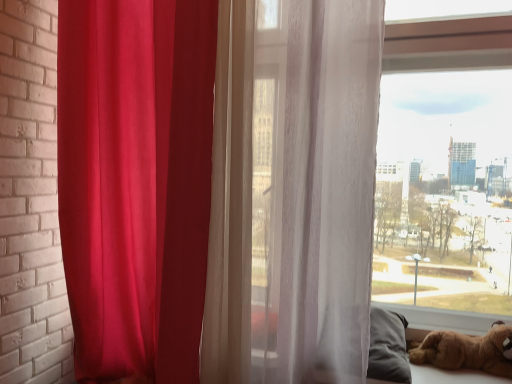
Measure the distance between point [473,350] and camera.

The distance of point [473,350] from camera is 1.62 meters.

Image resolution: width=512 pixels, height=384 pixels. Find the location of `brown plush toy at lower right`. brown plush toy at lower right is located at coordinates (466, 351).

Which object is wider, brown plush toy at lower right or translucent white curtain at center, which is counted as the second curtain, starting from the left?

With larger width is translucent white curtain at center, which is counted as the second curtain, starting from the left.

In the scene shown: Is brown plush toy at lower right not near translucent white curtain at center, which is counted as the second curtain, starting from the left?

Actually, brown plush toy at lower right and translucent white curtain at center, which is counted as the second curtain, starting from the left, are a little close together.

From the picture: Can you confirm if brown plush toy at lower right is positioned to the right of translucent white curtain at center, the 1th curtain from the right?

Yes.

Where is `dog lying behind the translucent white curtain at center, the 1th curtain from the right`? Image resolution: width=512 pixels, height=384 pixels. dog lying behind the translucent white curtain at center, the 1th curtain from the right is located at coordinates (466, 351).

Which object is positioned more to the right, translucent white curtain at center, which is counted as the second curtain, starting from the left, or brown plush toy at lower right?

From the viewer's perspective, brown plush toy at lower right appears more on the right side.

How many degrees apart are the facing directions of translucent white curtain at center, the 1th curtain from the right, and brown plush toy at lower right?

The angular difference between translucent white curtain at center, the 1th curtain from the right, and brown plush toy at lower right is 2.74 degrees.

Can you confirm if translucent white curtain at center, which is counted as the second curtain, starting from the left, is bigger than brown plush toy at lower right?

Yes, translucent white curtain at center, which is counted as the second curtain, starting from the left, is bigger than brown plush toy at lower right.

How far apart are translucent white curtain at center, which is counted as the second curtain, starting from the left, and brown plush toy at lower right?

They are 26.95 inches apart.

From the image's perspective, is translucent white curtain at center, which is counted as the second curtain, starting from the left, beneath matte red curtain at left, the first curtain viewed from the left?

Yes, from the image's perspective, translucent white curtain at center, which is counted as the second curtain, starting from the left, is below matte red curtain at left, the first curtain viewed from the left.

Which of these two, translucent white curtain at center, which is counted as the second curtain, starting from the left, or matte red curtain at left, which is the second curtain from right to left, stands shorter?

translucent white curtain at center, which is counted as the second curtain, starting from the left.

Is translucent white curtain at center, which is counted as the second curtain, starting from the left, directly adjacent to matte red curtain at left, which is the second curtain from right to left?

No, translucent white curtain at center, which is counted as the second curtain, starting from the left, is not in contact with matte red curtain at left, which is the second curtain from right to left.

Is translucent white curtain at center, the 1th curtain from the right, facing away from matte red curtain at left, which is the second curtain from right to left?

translucent white curtain at center, the 1th curtain from the right, does not have its back to matte red curtain at left, which is the second curtain from right to left.

Which object is wider, brown plush toy at lower right or matte red curtain at left, the first curtain viewed from the left?

matte red curtain at left, the first curtain viewed from the left.

Who is smaller, brown plush toy at lower right or matte red curtain at left, the first curtain viewed from the left?

Smaller between the two is brown plush toy at lower right.

Is brown plush toy at lower right positioned behind matte red curtain at left, the first curtain viewed from the left?

Yes, brown plush toy at lower right is behind matte red curtain at left, the first curtain viewed from the left.

Is brown plush toy at lower right far from matte red curtain at left, which is the second curtain from right to left?

Yes, brown plush toy at lower right and matte red curtain at left, which is the second curtain from right to left, are located far from each other.

Consider the image. Considering the sizes of matte red curtain at left, the first curtain viewed from the left, and translucent white curtain at center, which is counted as the second curtain, starting from the left, in the image, is matte red curtain at left, the first curtain viewed from the left, bigger or smaller than translucent white curtain at center, which is counted as the second curtain, starting from the left,?

Clearly, matte red curtain at left, the first curtain viewed from the left, is larger in size than translucent white curtain at center, which is counted as the second curtain, starting from the left.

From the image's perspective, is matte red curtain at left, the first curtain viewed from the left, below translucent white curtain at center, which is counted as the second curtain, starting from the left?

No, from the image's perspective, matte red curtain at left, the first curtain viewed from the left, is not below translucent white curtain at center, which is counted as the second curtain, starting from the left.

Is matte red curtain at left, the first curtain viewed from the left, positioned far away from translucent white curtain at center, the 1th curtain from the right?

matte red curtain at left, the first curtain viewed from the left, is near translucent white curtain at center, the 1th curtain from the right, not far away.

Is matte red curtain at left, which is the second curtain from right to left, facing towards translucent white curtain at center, the 1th curtain from the right?

No, matte red curtain at left, which is the second curtain from right to left, is not aimed at translucent white curtain at center, the 1th curtain from the right.

Is matte red curtain at left, the first curtain viewed from the left, far away from brown plush toy at lower right?

Absolutely, matte red curtain at left, the first curtain viewed from the left, is distant from brown plush toy at lower right.

Considering the sizes of matte red curtain at left, which is the second curtain from right to left, and brown plush toy at lower right in the image, is matte red curtain at left, which is the second curtain from right to left, taller or shorter than brown plush toy at lower right?

matte red curtain at left, which is the second curtain from right to left, is taller than brown plush toy at lower right.

Which is behind, point (137, 101) or point (506, 330)?

Point (137, 101)

Is matte red curtain at left, which is the second curtain from right to left, not inside brown plush toy at lower right?

Yes.

There is a brown plush toy at lower right. Identify the location of the 1st curtain above it (from a real-world perspective). click(314, 186).

Find the location of `the 1st curtain to the left of the brown plush toy at lower right, starting your count from the anchor`. the 1st curtain to the left of the brown plush toy at lower right, starting your count from the anchor is located at coordinates (314, 186).

Based on their spatial positions, is matte red curtain at left, which is the second curtain from right to left, or translucent white curtain at center, the 1th curtain from the right, further from brown plush toy at lower right?

The object further to brown plush toy at lower right is matte red curtain at left, which is the second curtain from right to left.

From the image, which object appears to be nearer to translucent white curtain at center, the 1th curtain from the right, brown plush toy at lower right or matte red curtain at left, the first curtain viewed from the left?

matte red curtain at left, the first curtain viewed from the left, is positioned closer to the anchor translucent white curtain at center, the 1th curtain from the right.

From the image, which object appears to be nearer to translucent white curtain at center, the 1th curtain from the right, matte red curtain at left, which is the second curtain from right to left, or brown plush toy at lower right?

Among the two, matte red curtain at left, which is the second curtain from right to left, is located nearer to translucent white curtain at center, the 1th curtain from the right.

Based on their spatial positions, is translucent white curtain at center, the 1th curtain from the right, or matte red curtain at left, the first curtain viewed from the left, closer to brown plush toy at lower right?

translucent white curtain at center, the 1th curtain from the right, lies closer to brown plush toy at lower right than the other object.

Considering their positions, is translucent white curtain at center, the 1th curtain from the right, positioned closer to matte red curtain at left, which is the second curtain from right to left, than brown plush toy at lower right?

translucent white curtain at center, the 1th curtain from the right, is positioned closer to the anchor matte red curtain at left, which is the second curtain from right to left.

Estimate the real-world distances between objects in this image. Which object is closer to matte red curtain at left, which is the second curtain from right to left, brown plush toy at lower right or translucent white curtain at center, the 1th curtain from the right?

Based on the image, translucent white curtain at center, the 1th curtain from the right, appears to be nearer to matte red curtain at left, which is the second curtain from right to left.

You are a GUI agent. You are given a task and a screenshot of the screen. Output one action in this format:
    pyautogui.click(x=<x>, y=<y>)
    Task: Click on the curtain between matte red curtain at left, which is the second curtain from right to left, and brown plush toy at lower right
    The image size is (512, 384).
    Given the screenshot: What is the action you would take?
    pyautogui.click(x=314, y=186)